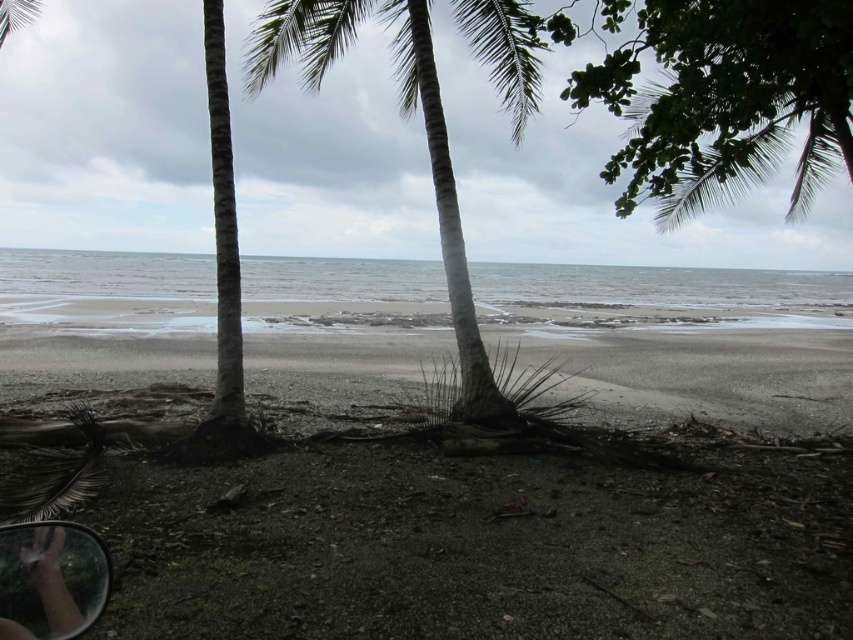
Question: Can you confirm if dark sand at center is positioned above green leafy coconut tree at center?

Choices:
 (A) no
 (B) yes

Answer: (A)

Question: Which object is farther from the camera taking this photo?

Choices:
 (A) dark sand at center
 (B) transparent glass car window at lower left

Answer: (A)

Question: Does green leafy tree at upper right come behind transparent glass car window at lower left?

Choices:
 (A) yes
 (B) no

Answer: (A)

Question: Which object is positioned closest to the green leafy tree at upper right?

Choices:
 (A) transparent glass car window at lower left
 (B) green leafy coconut tree at center
 (C) dark sand at center

Answer: (B)

Question: Where is dark sand at center located in relation to transparent glass car window at lower left in the image?

Choices:
 (A) right
 (B) left

Answer: (B)

Question: Which object appears closest to the camera in this image?

Choices:
 (A) green leafy coconut tree at center
 (B) dark sand at center

Answer: (B)